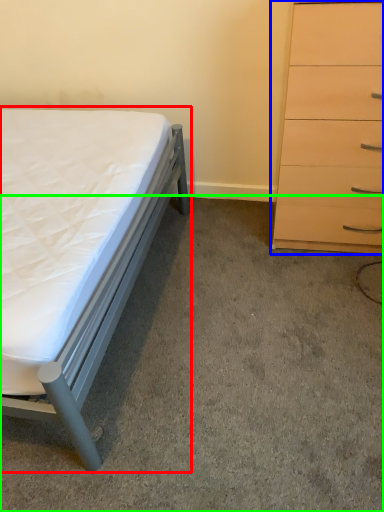
Question: Based on their relative distances, which object is nearer to bed (highlighted by a red box)? Choose from chest of drawers (highlighted by a blue box) and concrete (highlighted by a green box).

Choices:
 (A) chest of drawers
 (B) concrete

Answer: (B)